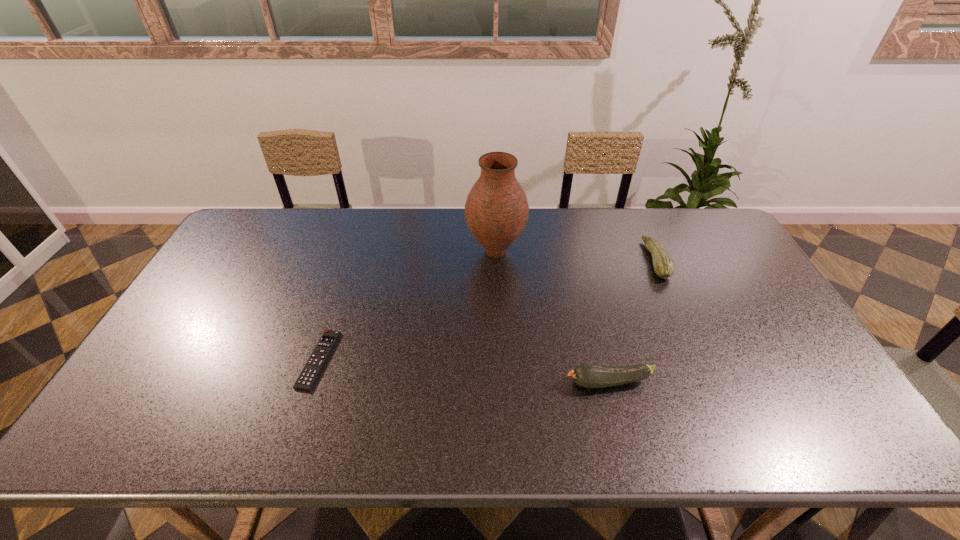
Locate an element on the screen. This screenshot has width=960, height=540. the tallest object is located at coordinates (496, 211).

Where is `vase`? This screenshot has height=540, width=960. vase is located at coordinates (496, 211).

Find the location of a particular element. This screenshot has height=540, width=960. the farther zucchini is located at coordinates (664, 267).

This screenshot has width=960, height=540. What are the coordinates of `the rightmost object` in the screenshot? It's located at (664, 267).

Identify the location of the nearer zucchini. This screenshot has height=540, width=960. pyautogui.click(x=586, y=375).

Locate an element on the screen. This screenshot has height=540, width=960. the second object from right to left is located at coordinates [586, 375].

Image resolution: width=960 pixels, height=540 pixels. I want to click on remote control, so pos(317,360).

Where is `the shortest object`? The width and height of the screenshot is (960, 540). the shortest object is located at coordinates point(317,360).

I want to click on free spot located 0.270m on the front of the vase, so click(499, 339).

The width and height of the screenshot is (960, 540). In order to click on vacant region located 0.110m at the stem end of the rightmost object in this screenshot , I will do `click(612, 260)`.